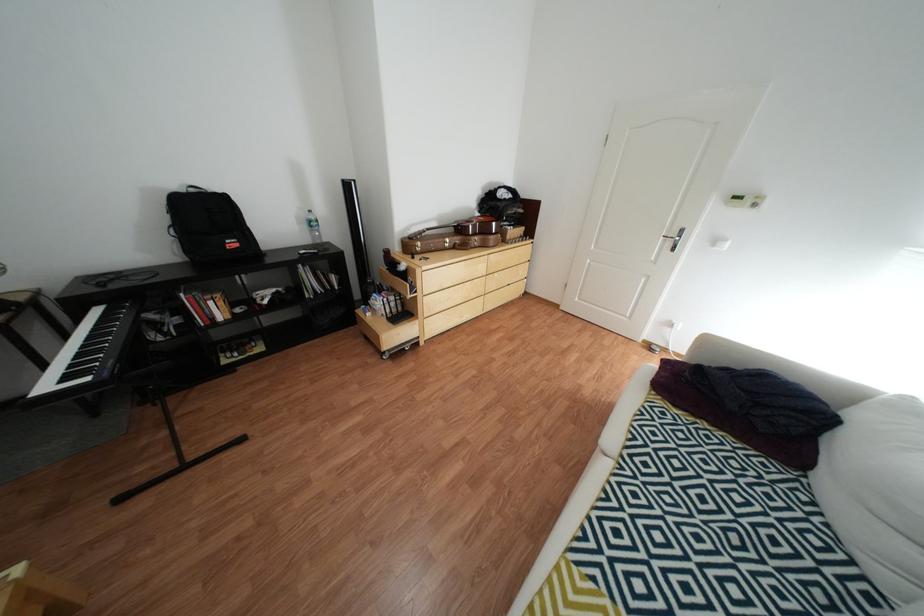
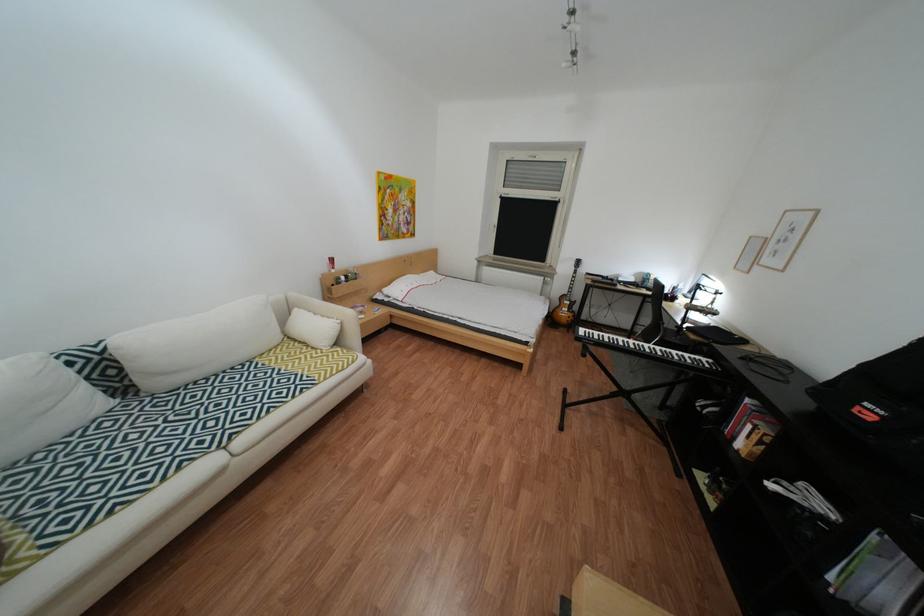
Find the pixel in the second image that matches the point at 228,320 in the first image.

(749, 439)